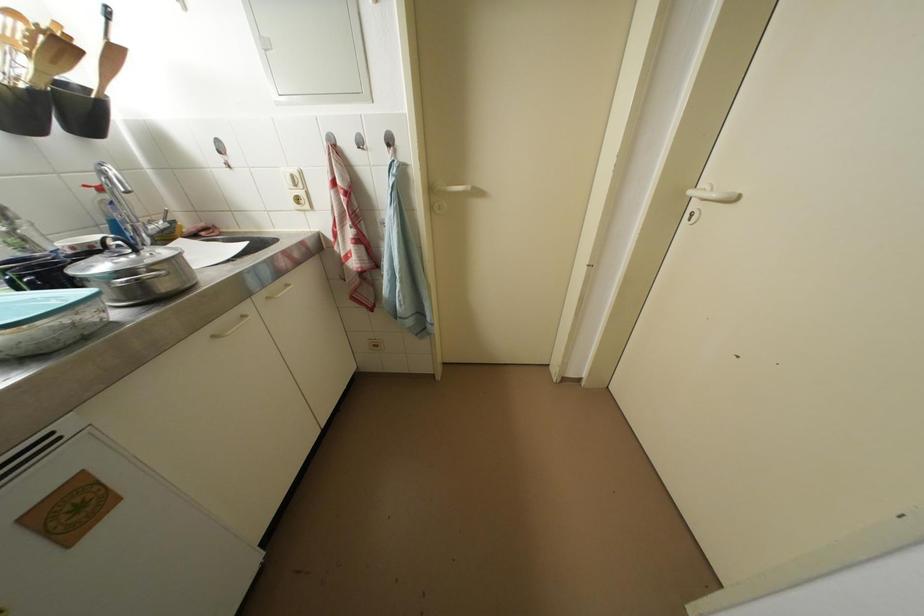
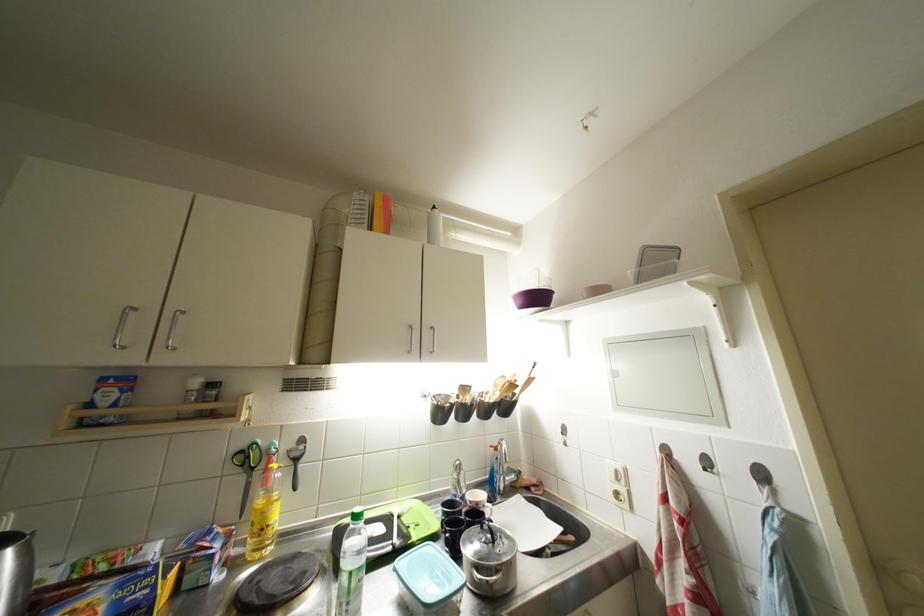
Where in the second image is the point corresponding to point 69,50 from the first image?

(519, 390)